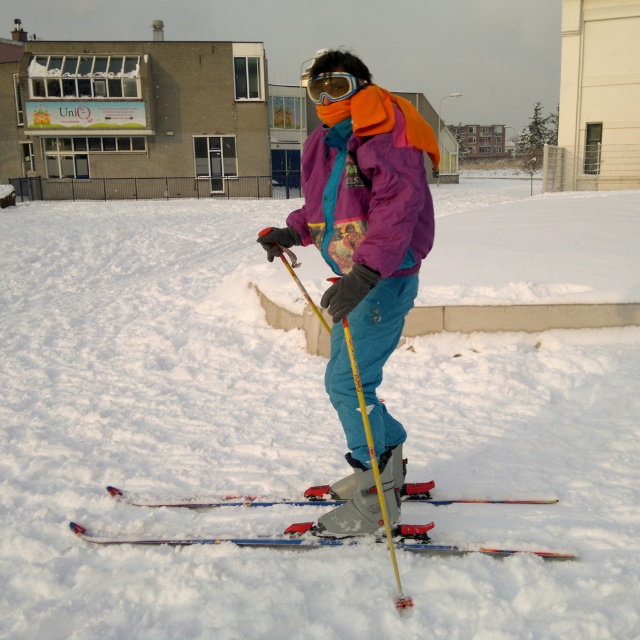
Can you confirm if purple matte jacket at center is taller than multicolored plastic skis at center?

Yes, purple matte jacket at center is taller than multicolored plastic skis at center.

Consider the image. Is purple matte jacket at center smaller than multicolored plastic skis at center?

No, purple matte jacket at center is not smaller than multicolored plastic skis at center.

This screenshot has height=640, width=640. Identify the location of purple matte jacket at center. (364, 260).

Can you confirm if purple matte jacket at center is positioned above glossy plastic goggles at upper center?

Actually, purple matte jacket at center is below glossy plastic goggles at upper center.

Is purple matte jacket at center smaller than glossy plastic goggles at upper center?

Incorrect, purple matte jacket at center is not smaller in size than glossy plastic goggles at upper center.

Which is in front, point (353, 256) or point (330, 88)?

Point (353, 256) is in front.

The height and width of the screenshot is (640, 640). What are the coordinates of `purple matte jacket at center` in the screenshot? It's located at (364, 260).

Which is behind, point (134, 502) or point (394, 566)?

Point (134, 502)

How much distance is there between multicolored plastic skis at center and yellow plastic ski pole at center?

multicolored plastic skis at center and yellow plastic ski pole at center are 28.91 inches apart from each other.

Is point (164, 538) closer to camera compared to point (365, 426)?

No, (164, 538) is behind (365, 426).

The image size is (640, 640). In order to click on multicolored plastic skis at center in this screenshot , I will do `click(221, 538)`.